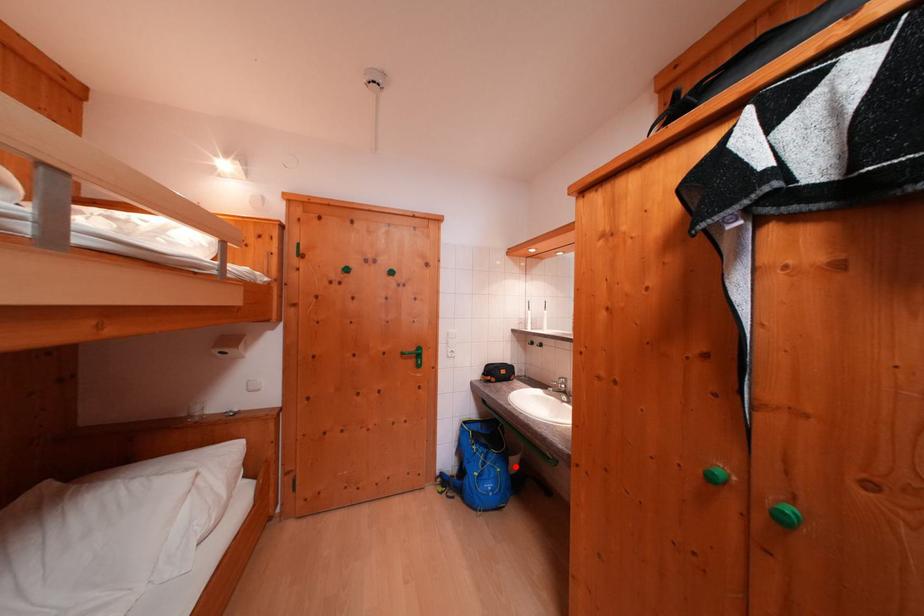
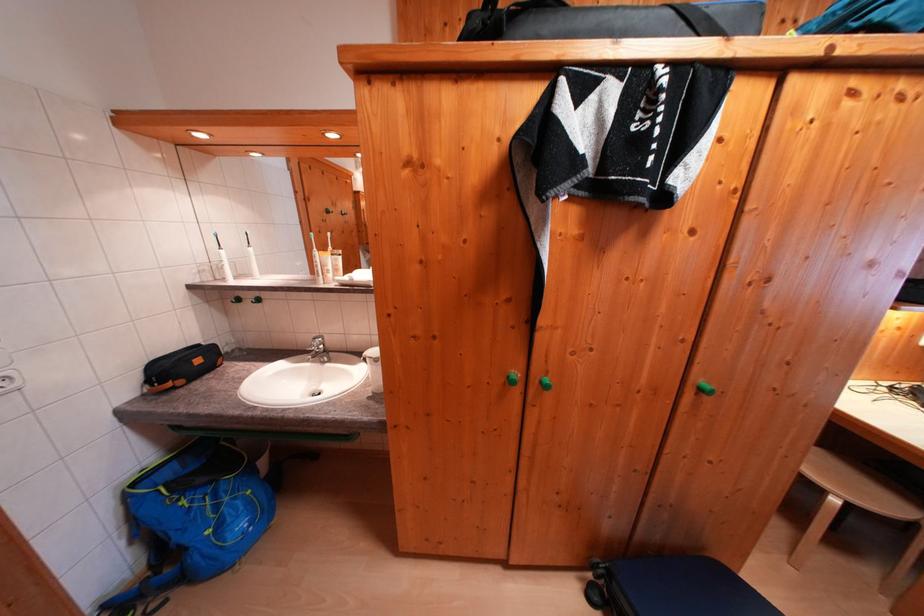
Where in the second image is the point corresponding to the highlighted location from the first image?

(262, 476)